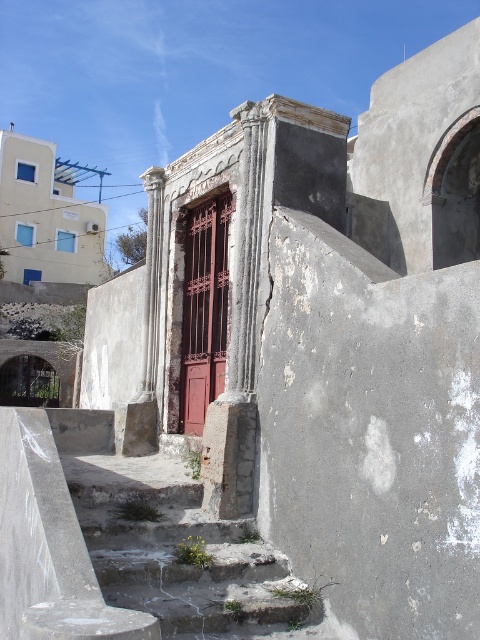
You are a delivery person trying to carry a large package up the stairs. The package is as wide as the rusty metal door at center. Will the rusty concrete stairs at lower center be wide enough to accommodate the package?

The rusty concrete stairs at lower center are wider than the rusty metal door at center, so the stairs should be wide enough to accommodate the package since the stairs are wider than the door, which matches the package width.

You are standing at the base of the stone structure and want to reach the red wooden door. There are rusty concrete stairs at lower center marked by point (190, 564). Are the stairs directly in front of you or to the side?

The stairs marked by point (190, 564) are at the lower center, so they are directly in front of you when standing at the base of the stone structure.

You are a delivery person trying to reach the entrance of the historical building. You see the rusty concrete stairs at lower center and the rusty metal door at center. Which one is lower in height?

The rusty concrete stairs at lower center has a lesser height compared to the rusty metal door at center, so the stairs are lower in height.